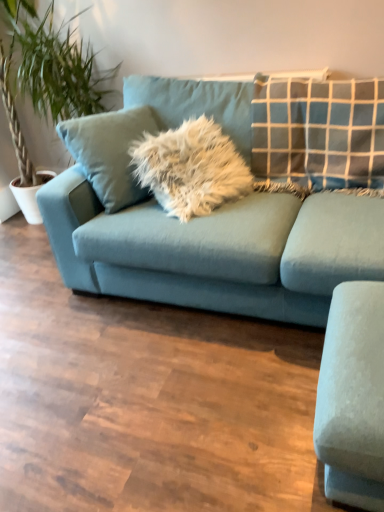
Question: From the image's perspective, is matte blue couch at center located above or below white ceramic pot at left?

Choices:
 (A) below
 (B) above

Answer: (A)

Question: Would you say matte blue couch at center is inside or outside white ceramic pot at left?

Choices:
 (A) inside
 (B) outside

Answer: (B)

Question: Considering the real-world distances, which object is closest to the matte blue couch at center?

Choices:
 (A) green leafy plant at left
 (B) white ceramic pot at left

Answer: (A)

Question: Which object is positioned closest to the green leafy plant at left?

Choices:
 (A) matte blue couch at center
 (B) white ceramic pot at left

Answer: (B)